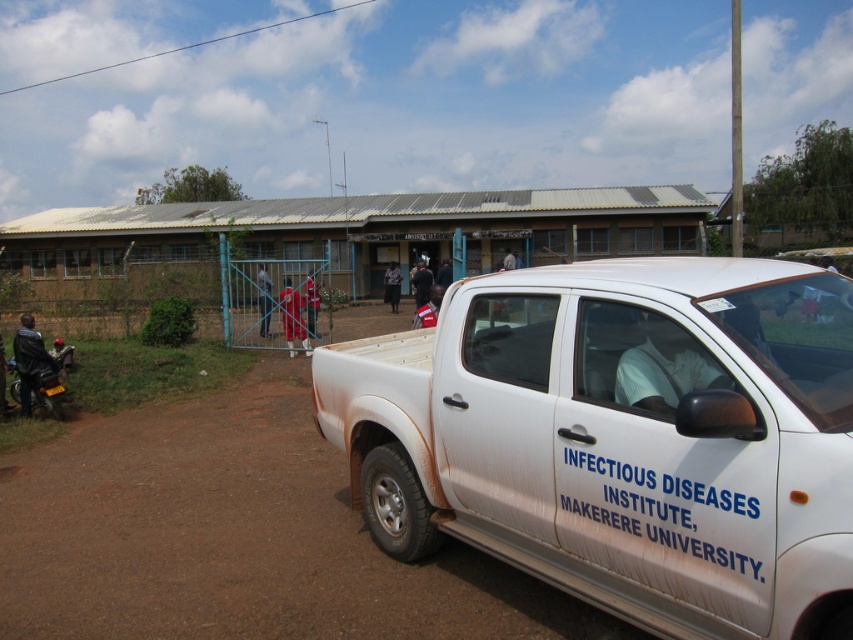
From the picture: You are standing in front of the Infectious Diseases Institute, Makerere University. You see a white pickup truck parked on a dirt road with text on its side. Where is the leather jacket at left located in relation to the truck?

The leather jacket at left is located at the point (28, 356) in the image, which is to the left side of the white pickup truck parked on the dirt road.

You are a photographer trying to capture both the white matte truck at center and the red fabric person at center in a single frame. Based on their sizes in the image, which object will appear larger in your photo?

The white matte truck at center will appear larger in the photo because it is taller than the red fabric person at center.